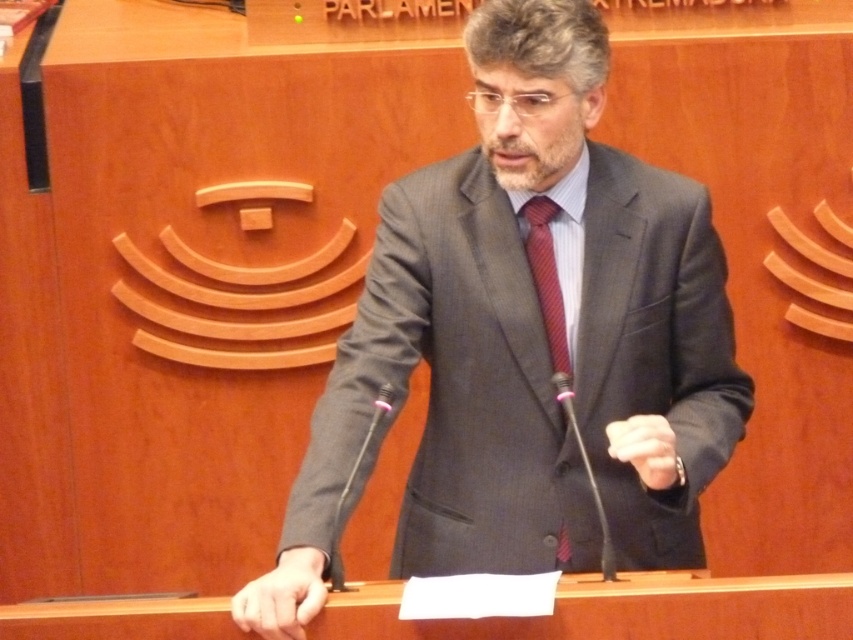
Question: Is matte gray suit at center to the left of red striped tie at center from the viewer's perspective?

Choices:
 (A) no
 (B) yes

Answer: (B)

Question: Which object is closer to the camera taking this photo?

Choices:
 (A) red striped tie at center
 (B) matte gray suit at center

Answer: (B)

Question: Does matte gray suit at center appear under red striped tie at center?

Choices:
 (A) no
 (B) yes

Answer: (B)

Question: Which object is farther from the camera taking this photo?

Choices:
 (A) matte gray suit at center
 (B) red striped tie at center

Answer: (B)

Question: Is matte gray suit at center in front of red striped tie at center?

Choices:
 (A) yes
 (B) no

Answer: (A)